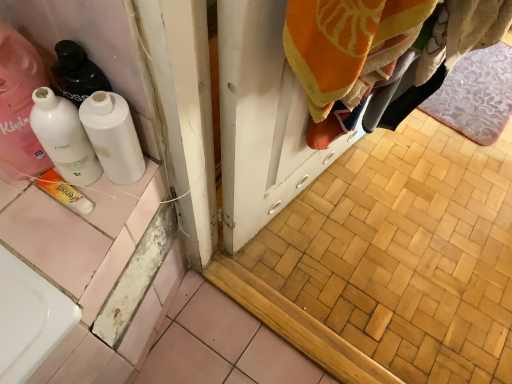
Question: Can we say white glossy bottle at left lies outside yellow matte tube at lower left?

Choices:
 (A) yes
 (B) no

Answer: (A)

Question: Does white glossy bottle at left turn towards yellow matte tube at lower left?

Choices:
 (A) yes
 (B) no

Answer: (B)

Question: From a real-world perspective, is white glossy bottle at left positioned under yellow matte tube at lower left based on gravity?

Choices:
 (A) yes
 (B) no

Answer: (B)

Question: Can you confirm if white glossy bottle at left is smaller than yellow matte tube at lower left?

Choices:
 (A) yes
 (B) no

Answer: (B)

Question: Can you confirm if white glossy bottle at left is bigger than yellow matte tube at lower left?

Choices:
 (A) yes
 (B) no

Answer: (A)

Question: From a real-world perspective, does white glossy bottle at left stand above yellow matte tube at lower left?

Choices:
 (A) no
 (B) yes

Answer: (B)

Question: From a real-world perspective, is pink floral bath mat at lower right under white glossy bottle at left, placed as the 2th bottle when sorted from left to right?

Choices:
 (A) no
 (B) yes

Answer: (B)

Question: From the image's perspective, is pink floral bath mat at lower right over white glossy bottle at left, the 1th bottle viewed from the right?

Choices:
 (A) yes
 (B) no

Answer: (A)

Question: Is pink floral bath mat at lower right located outside white glossy bottle at left, placed as the 2th bottle when sorted from left to right?

Choices:
 (A) no
 (B) yes

Answer: (B)

Question: Can you see pink floral bath mat at lower right touching white glossy bottle at left, placed as the 2th bottle when sorted from left to right?

Choices:
 (A) no
 (B) yes

Answer: (A)

Question: Is pink floral bath mat at lower right turned away from white glossy bottle at left, the 1th bottle viewed from the right?

Choices:
 (A) yes
 (B) no

Answer: (B)

Question: Is pink floral bath mat at lower right smaller than white glossy bottle at left, placed as the 2th bottle when sorted from left to right?

Choices:
 (A) no
 (B) yes

Answer: (A)

Question: Can you confirm if yellow matte tube at lower left is positioned to the left of white glossy bottle at left, the first bottle positioned from the left?

Choices:
 (A) yes
 (B) no

Answer: (A)